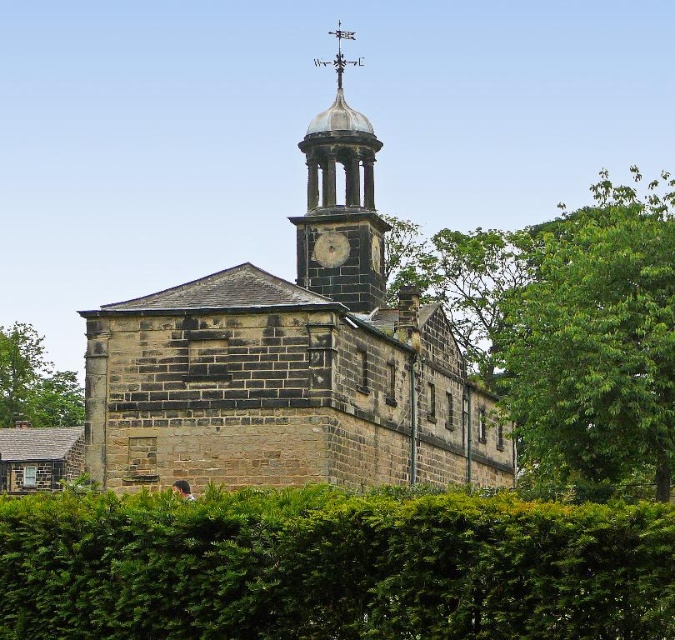
You are standing in front of the historic stone building and want to take a photo that includes both the green leafy tree at upper right and the metallic clock face at center. Which object will appear larger in the photo?

The green leafy tree at upper right is taller than the metallic clock face at center, so it will appear larger in the photo.

You are a gardener standing in front of the green leafy hedge at lower center and the dark gray stone clock tower at upper center. Which object would require more space to maintain its current size? Please explain based on their sizes.

The dark gray stone clock tower at upper center requires more space to maintain its current size because it is larger than the green leafy hedge at lower center.

You are standing in a park and see the green leafy hedge at lower center and the dark gray stone clock tower at upper center. Which object is closer to you?

The green leafy hedge at lower center is closer to you because it is in front of the dark gray stone clock tower at upper center.